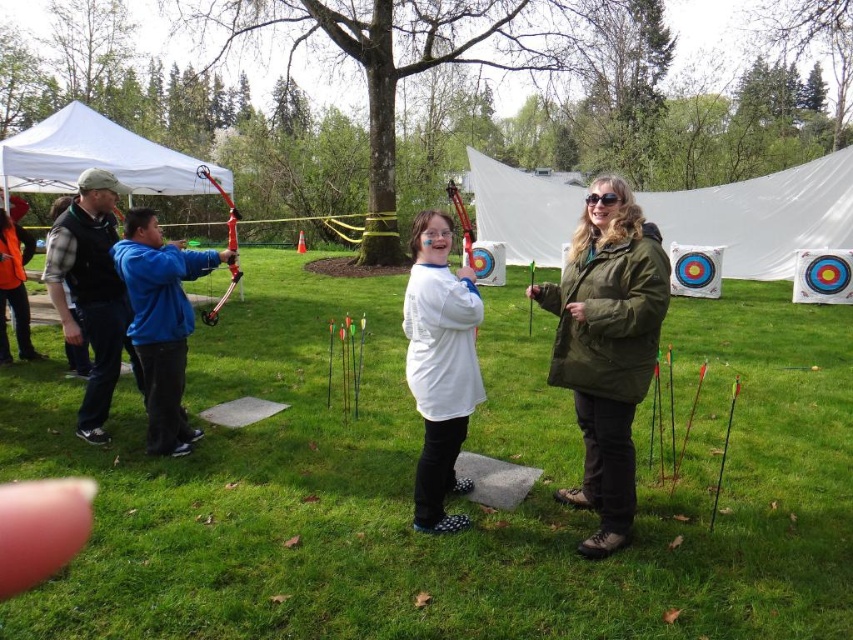
Question: Is olive green parka at center further to camera compared to white fabric tent at upper center?

Choices:
 (A) no
 (B) yes

Answer: (A)

Question: Is white fabric tent at upper center bigger than white matte shirt at center?

Choices:
 (A) no
 (B) yes

Answer: (A)

Question: Among these points, which one is farthest from the camera?

Choices:
 (A) [x=1, y=346]
 (B) [x=166, y=275]

Answer: (A)

Question: Is matte black vest at left further to camera compared to orange fleece jacket at left?

Choices:
 (A) yes
 (B) no

Answer: (B)

Question: Which object appears farthest from the camera in this image?

Choices:
 (A) olive green parka at center
 (B) white matte shirt at center
 (C) orange fleece jacket at left

Answer: (C)

Question: Which point is closer to the camera?

Choices:
 (A) (146, 406)
 (B) (849, 161)

Answer: (A)